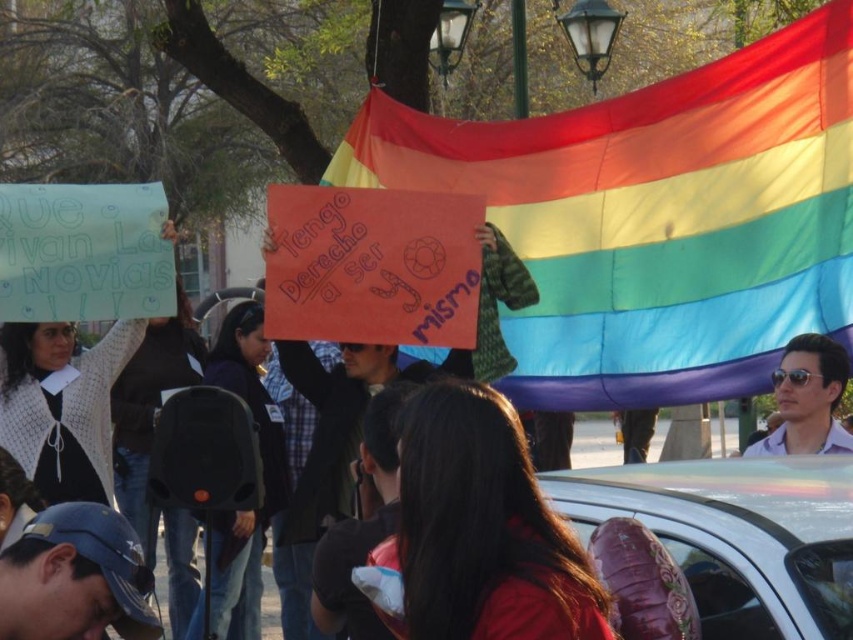
You are a photographer trying to capture a clear shot of the rainbow fabric flag at center and the dark brown hair at center. Which object should you focus on first to ensure it appears larger in your photo?

The rainbow fabric flag at center is taller than the dark brown hair at center, so focusing on the rainbow fabric flag at center first will ensure it appears larger in the photo.